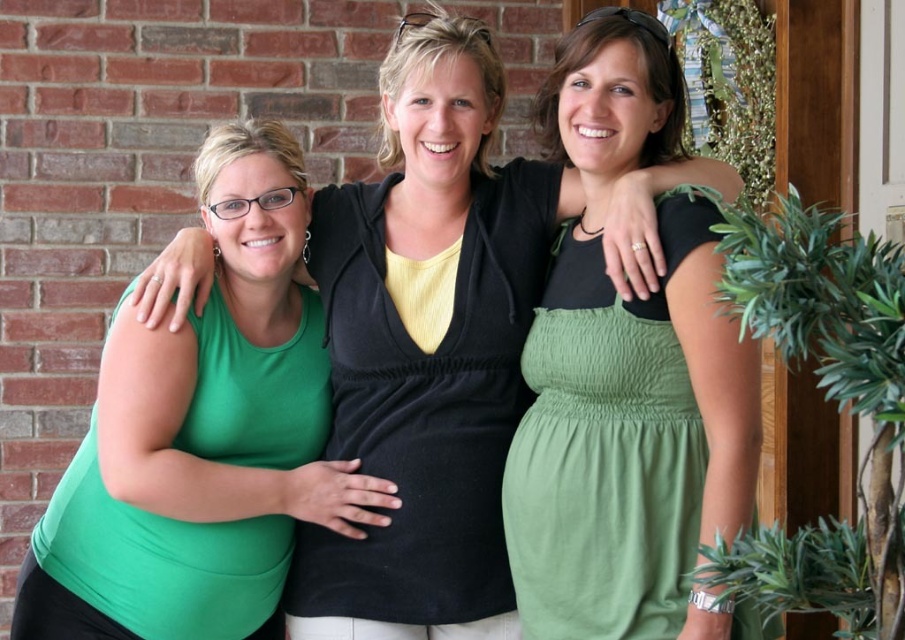
Can you confirm if matte black top at center is taller than matte black dress at center?

Correct, matte black top at center is much taller as matte black dress at center.

Where is `matte black top at center`? The height and width of the screenshot is (640, 905). matte black top at center is located at coordinates (427, 346).

Does green cotton dress at center have a smaller size compared to green matte dress at left?

No.

Is green cotton dress at center to the left of green matte dress at left from the viewer's perspective?

→ In fact, green cotton dress at center is to the right of green matte dress at left.

Locate an element on the screen. The image size is (905, 640). green cotton dress at center is located at coordinates (607, 449).

Who is positioned more to the left, matte black top at center or green cotton dress at center?

From the viewer's perspective, matte black top at center appears more on the left side.

Which is above, matte black top at center or green cotton dress at center?

matte black top at center

Is point (384, 193) more distant than point (653, 346)?

Yes, point (384, 193) is farther from viewer.

Locate an element on the screen. Image resolution: width=905 pixels, height=640 pixels. matte black top at center is located at coordinates (427, 346).